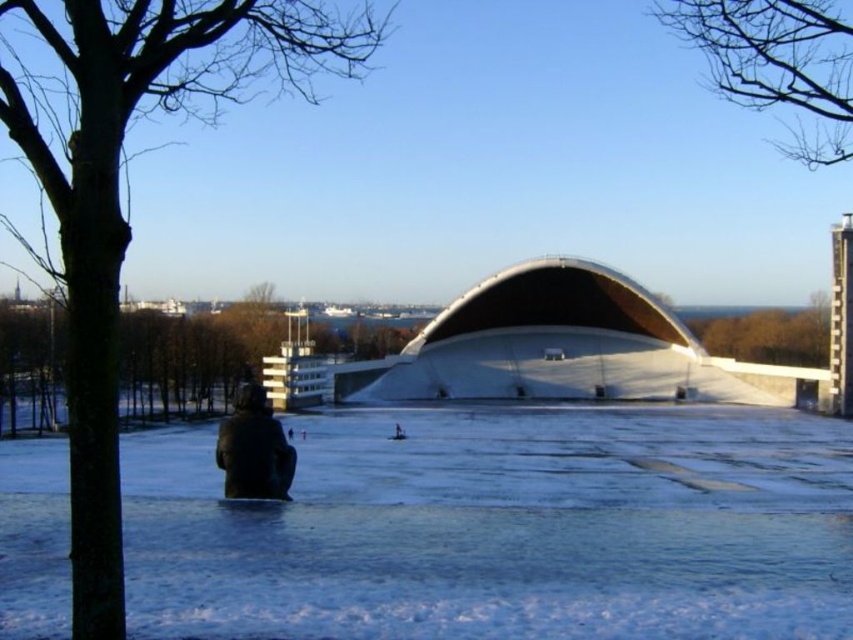
Which is in front, point (70, 176) or point (811, 346)?

Point (70, 176) is in front.

Can you confirm if brown bark tree at left is smaller than green leafy tree at upper center?

Incorrect, brown bark tree at left is not smaller in size than green leafy tree at upper center.

Between point (157, 4) and point (798, 358), which one is positioned behind?

Point (798, 358)

The height and width of the screenshot is (640, 853). Find the location of `brown bark tree at left`. brown bark tree at left is located at coordinates (119, 186).

In the scene shown: Who is higher up, white matte snow at center or brown bark tree at left?

brown bark tree at left is above.

From the picture: Does white matte snow at center have a larger size compared to brown bark tree at left?

Incorrect, white matte snow at center is not larger than brown bark tree at left.

The image size is (853, 640). Describe the element at coordinates (502, 528) in the screenshot. I see `white matte snow at center` at that location.

This screenshot has height=640, width=853. I want to click on white matte snow at center, so click(x=502, y=528).

Can you confirm if green leafy tree at upper center is taller than black matte jacket at lower center?

Yes, green leafy tree at upper center is taller than black matte jacket at lower center.

Which is in front, point (822, 294) or point (267, 484)?

Point (267, 484)

Identify the location of green leafy tree at upper center. (766, 332).